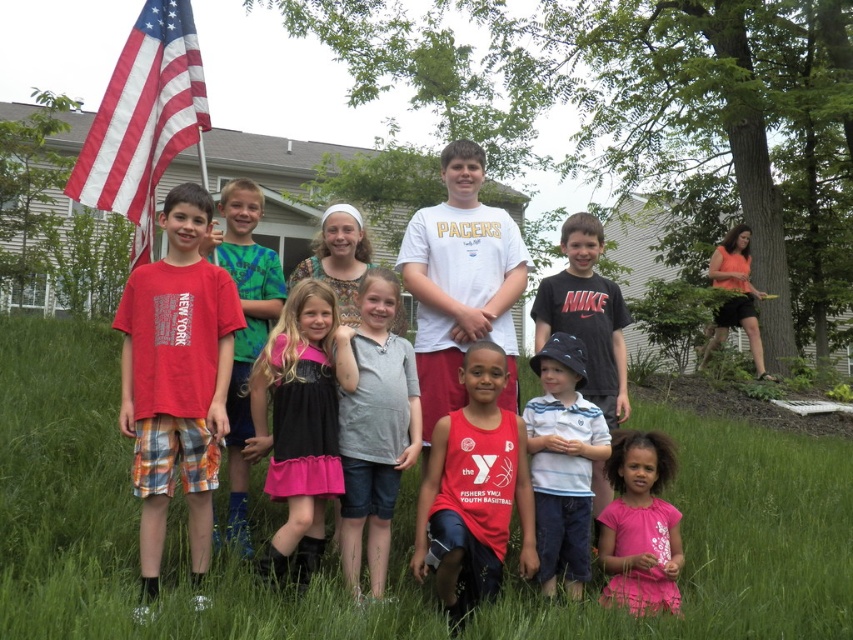
Question: Which object is farther from the camera taking this photo?

Choices:
 (A) pink fabric dress at lower right
 (B) gray cotton shirt at center
 (C) matte red t-shirt at left
 (D) matte red shirt at center

Answer: (D)

Question: From the image, what is the correct spatial relationship of matte red t-shirt at left in relation to red jersey at center?

Choices:
 (A) right
 (B) left

Answer: (B)

Question: Which of the following is the farthest from the observer?

Choices:
 (A) (492, 480)
 (B) (177, 147)
 (C) (254, 252)
 (D) (389, 275)

Answer: (C)

Question: In this image, where is gray cotton shirt at center located relative to pink fabric dress at lower right?

Choices:
 (A) right
 (B) left

Answer: (B)

Question: Is red jersey at center above pink satin dress at center?

Choices:
 (A) yes
 (B) no

Answer: (B)

Question: Which of these objects is positioned farthest from the green grass at center?

Choices:
 (A) matte red t-shirt at left
 (B) matte red shirt at center

Answer: (B)